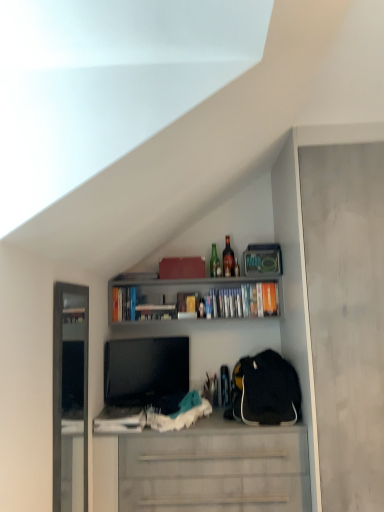
Question: Considering the relative sizes of matte cardboard book at upper center, which appears as the second book when viewed from the right, and matte gray cabinet at right in the image provided, is matte cardboard book at upper center, which appears as the second book when viewed from the right, smaller than matte gray cabinet at right?

Choices:
 (A) no
 (B) yes

Answer: (B)

Question: Considering the relative positions of matte cardboard book at upper center, the 2th book positioned from the left, and matte gray cabinet at right in the image provided, is matte cardboard book at upper center, the 2th book positioned from the left, to the right of matte gray cabinet at right from the viewer's perspective?

Choices:
 (A) no
 (B) yes

Answer: (A)

Question: Can you confirm if matte cardboard book at upper center, which appears as the second book when viewed from the right, is wider than matte gray cabinet at right?

Choices:
 (A) yes
 (B) no

Answer: (B)

Question: Is matte cardboard book at upper center, the 2th book positioned from the left, at the left side of matte gray cabinet at right?

Choices:
 (A) yes
 (B) no

Answer: (A)

Question: Considering the relative sizes of matte cardboard book at upper center, the 2th book positioned from the left, and matte gray cabinet at right in the image provided, is matte cardboard book at upper center, the 2th book positioned from the left, taller than matte gray cabinet at right?

Choices:
 (A) no
 (B) yes

Answer: (A)

Question: From the image's perspective, is green glass bottle at upper center, which appears as the first bottle when viewed from the left, above or below translucent glass bottle at upper center, which is counted as the 1th bottle, starting from the right?

Choices:
 (A) above
 (B) below

Answer: (B)

Question: From a real-world perspective, is green glass bottle at upper center, which appears as the first bottle when viewed from the left, physically located above or below translucent glass bottle at upper center, the second bottle in the left-to-right sequence?

Choices:
 (A) below
 (B) above

Answer: (A)

Question: Considering their positions, is green glass bottle at upper center, which appears as the first bottle when viewed from the left, located in front of or behind translucent glass bottle at upper center, the second bottle in the left-to-right sequence?

Choices:
 (A) behind
 (B) front

Answer: (A)

Question: Looking at the image, does green glass bottle at upper center, acting as the second bottle starting from the right, seem bigger or smaller compared to translucent glass bottle at upper center, which is counted as the 1th bottle, starting from the right?

Choices:
 (A) big
 (B) small

Answer: (B)

Question: From the image's perspective, is hardcover books at upper center, the third book positioned from the right, located above or below white matte cabinet at center?

Choices:
 (A) above
 (B) below

Answer: (A)

Question: Is point (117, 318) positioned closer to the camera than point (263, 500)?

Choices:
 (A) closer
 (B) farther

Answer: (B)

Question: From a real-world perspective, is hardcover books at upper center, the third book positioned from the right, positioned above or below white matte cabinet at center?

Choices:
 (A) above
 (B) below

Answer: (A)

Question: In terms of height, does hardcover books at upper center, the third book positioned from the right, look taller or shorter compared to white matte cabinet at center?

Choices:
 (A) tall
 (B) short

Answer: (B)

Question: Does point (249, 287) appear closer or farther from the camera than point (263, 450)?

Choices:
 (A) closer
 (B) farther

Answer: (B)

Question: From their relative heights in the image, would you say hardcover books at upper center, arranged as the third book when viewed from the left, is taller or shorter than white matte cabinet at center?

Choices:
 (A) tall
 (B) short

Answer: (B)